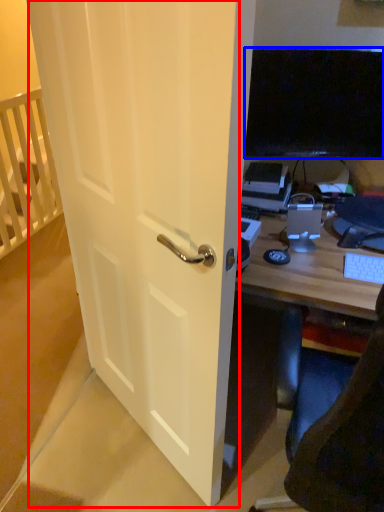
Question: Which object appears closest to the camera in this image, screen door (highlighted by a red box) or television (highlighted by a blue box)?

Choices:
 (A) screen door
 (B) television

Answer: (A)